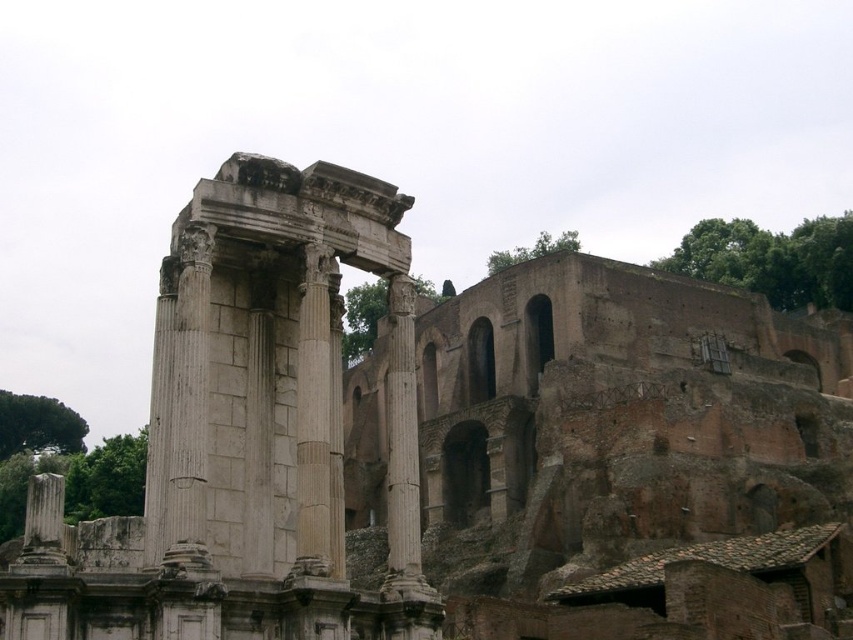
You are standing at the entrance of the ancient structure and want to move towards the two points marked in the image. Which point, point [314,417] or point [409,518], is closer to you?

Point [314,417] is closer to the viewer than point [409,518], so you should head towards point [314,417] first.